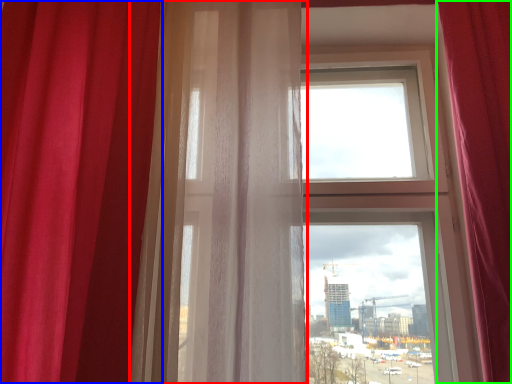
Question: Considering the real-world distances, which object is closest to curtain (highlighted by a red box)? curtain (highlighted by a blue box) or curtain (highlighted by a green box).

Choices:
 (A) curtain
 (B) curtain

Answer: (A)